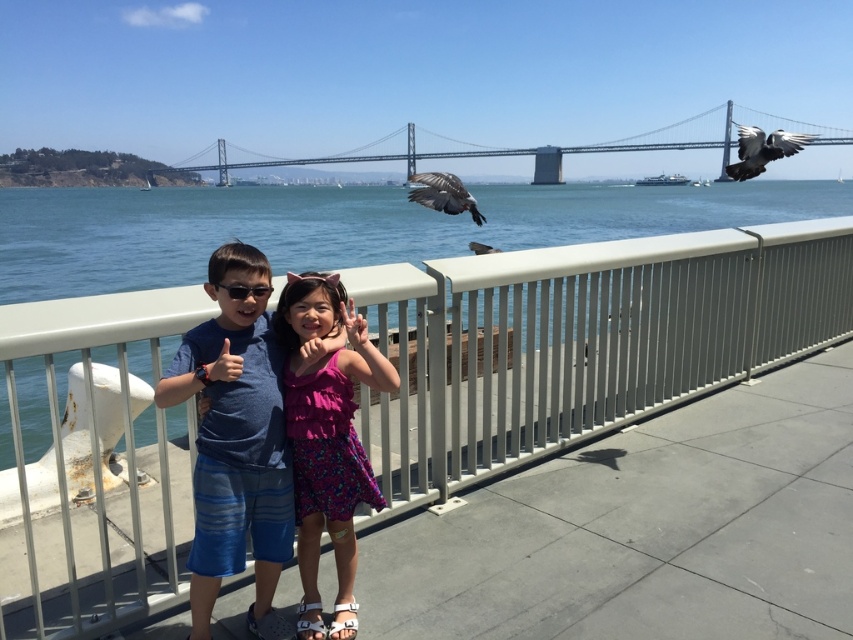
You are a photographer trying to capture a clear shot of the pink floral dress at center and the black plastic sunglasses at center. Which object should you zoom in on to ensure it fills the frame more effectively?

The pink floral dress at center is larger in size compared to the black plastic sunglasses at center, so zooming in on the pink floral dress at center would fill the frame more effectively.